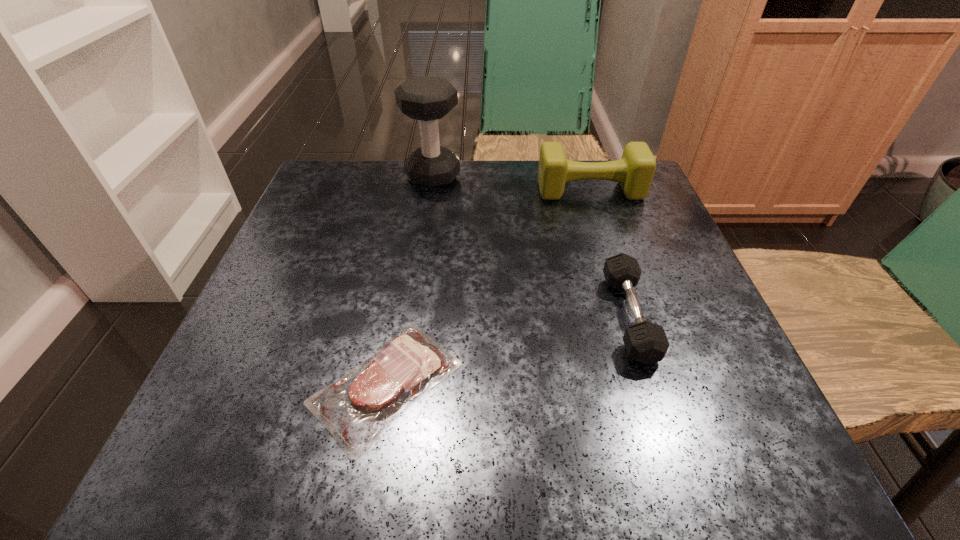
The image size is (960, 540). I want to click on the tallest object, so click(427, 98).

Identify the location of the leftmost dumbbell. (427, 98).

Find the location of a particular element. the third shortest object is located at coordinates click(634, 171).

What are the coordinates of `the shortest dumbbell` in the screenshot? It's located at (646, 342).

Identify the location of the second shortest object. (646, 342).

I want to click on steak, so click(x=356, y=408).

Image resolution: width=960 pixels, height=540 pixels. In order to click on free point located 0.220m on the right of the tallest object in this screenshot , I will do `click(554, 176)`.

Locate an element on the screen. vacant space situated 0.340m on the left of the second tallest dumbbell is located at coordinates (388, 190).

This screenshot has height=540, width=960. Identify the location of free space located 0.140m on the left of the nearest dumbbell. (527, 316).

Locate an element on the screen. vacant region located on the right of the shortest object is located at coordinates (517, 383).